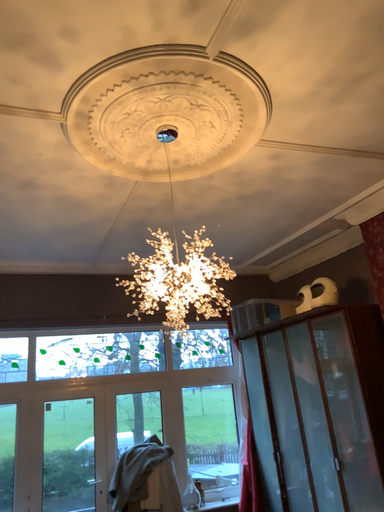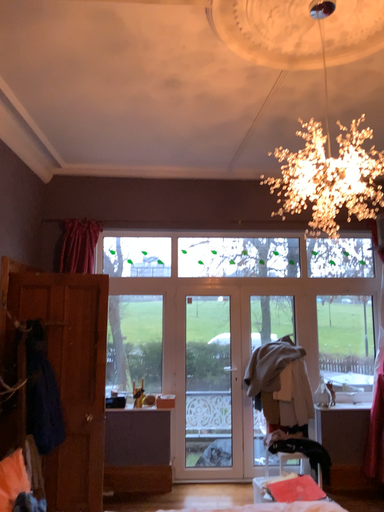
Question: Which way did the camera rotate in the video?

Choices:
 (A) rotated left
 (B) rotated right

Answer: (A)